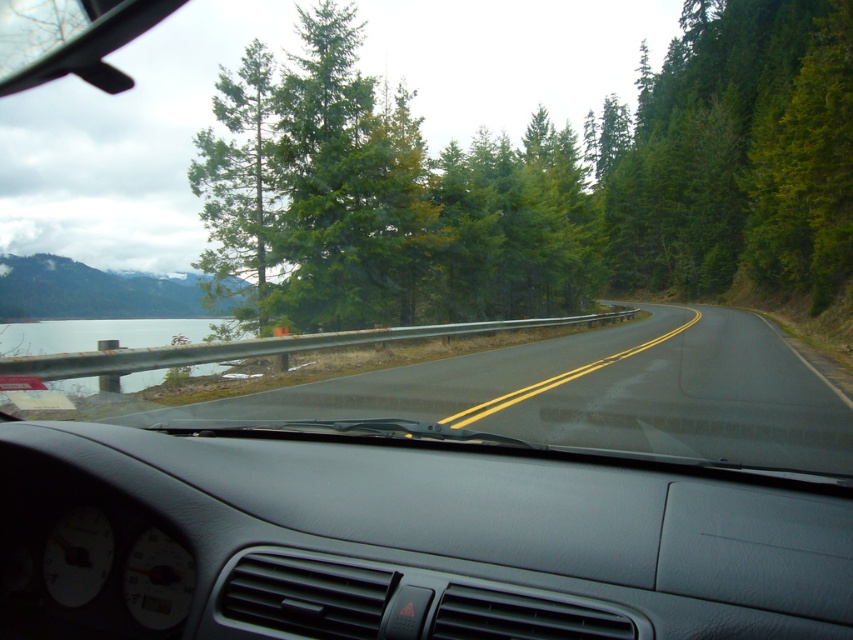
Is black asphalt road at center smaller than green textured pine tree at upper center?

Yes, black asphalt road at center is smaller than green textured pine tree at upper center.

Can you confirm if black asphalt road at center is shorter than green textured pine tree at upper center?

Correct, black asphalt road at center is not as tall as green textured pine tree at upper center.

You are a GUI agent. You are given a task and a screenshot of the screen. Output one action in this format:
    pyautogui.click(x=<x>, y=<y>)
    Task: Click on the black asphalt road at center
    
    Given the screenshot: What is the action you would take?
    pyautogui.click(x=598, y=394)

Identify the location of green textured tree at center. (572, 180).

Is green textured tree at center below black asphalt road at center?

Actually, green textured tree at center is above black asphalt road at center.

Measure the distance between point (706, 214) and camera.

Point (706, 214) and camera are 70.95 meters apart from each other.

You are a GUI agent. You are given a task and a screenshot of the screen. Output one action in this format:
    pyautogui.click(x=<x>, y=<y>)
    Task: Click on the green textured tree at center
    
    Given the screenshot: What is the action you would take?
    pyautogui.click(x=572, y=180)

Does green textured tree at center appear on the right side of clear glass water at left?

Correct, you'll find green textured tree at center to the right of clear glass water at left.

The width and height of the screenshot is (853, 640). I want to click on green textured tree at center, so click(572, 180).

At what (x,y) coordinates should I click in order to perform the action: click on green textured tree at center. Please return your answer as a coordinate pair (x, y). Image resolution: width=853 pixels, height=640 pixels. Looking at the image, I should click on (572, 180).